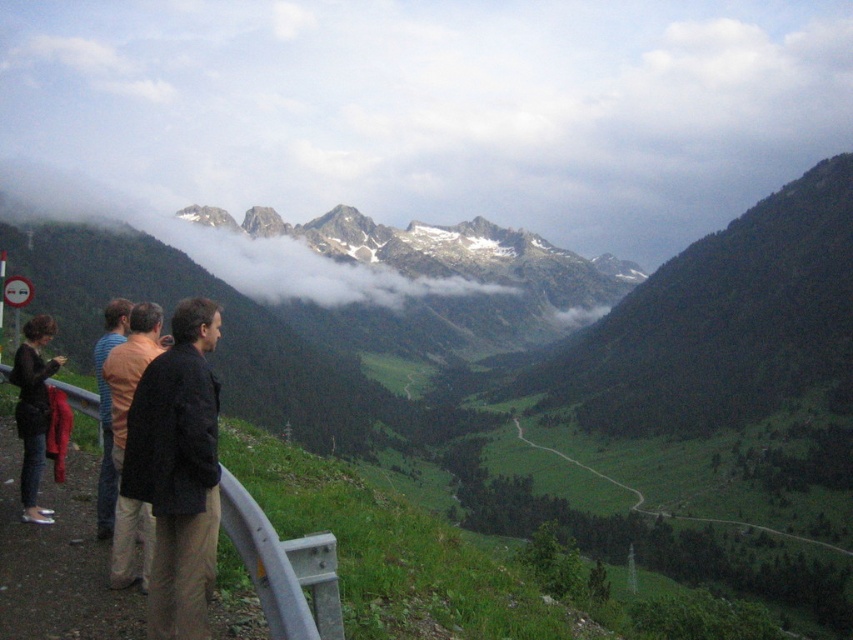
Question: Which point appears farthest from the camera in this image?

Choices:
 (A) (114, 422)
 (B) (611, 480)
 (C) (33, 454)
 (D) (105, 324)

Answer: (B)

Question: Is black fabric jacket at center bigger than brown wool sweater at left?

Choices:
 (A) yes
 (B) no

Answer: (B)

Question: Is black fabric jacket at center positioned in front of green grassy path at center?

Choices:
 (A) no
 (B) yes

Answer: (B)

Question: Does black fabric jacket at center come behind green grassy path at center?

Choices:
 (A) yes
 (B) no

Answer: (B)

Question: Which point is closer to the camera taking this photo?

Choices:
 (A) (196, 620)
 (B) (105, 436)

Answer: (A)

Question: Which is nearer to the brown wool sweater at left?

Choices:
 (A) dark blue jeans at left
 (B) black fabric jacket at center
 (C) black wool coat at left

Answer: (C)